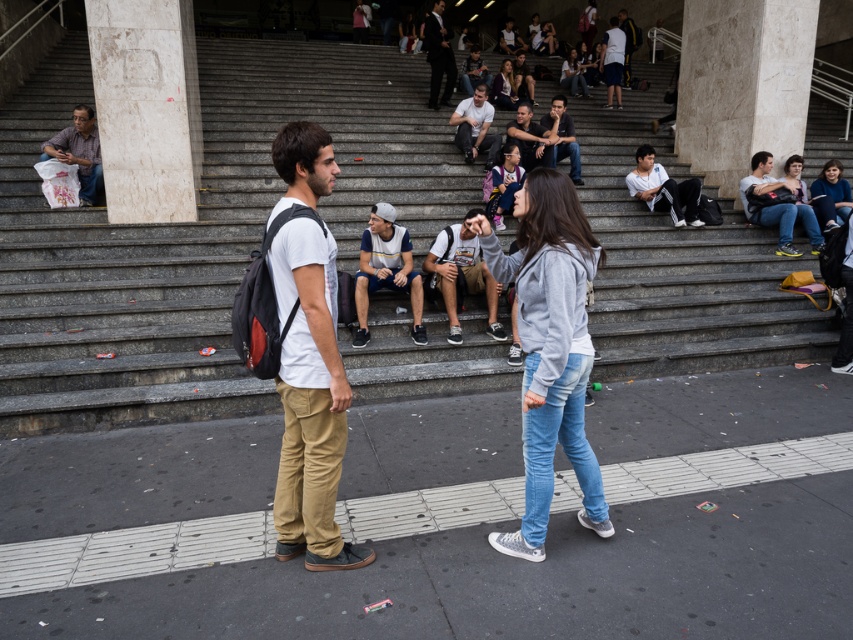
You are a photographer trying to capture a candid shot of the two people in the scene. You notice the light blue denim jeans at center and the dark gray backpack at center. Which object is wider in the frame to ensure proper framing?

The light blue denim jeans at center is wider than the dark gray backpack at center, so you should frame the shot to accommodate its larger width.

You are a photographer trying to capture a candid shot of the white cotton shirt at upper center without including the dark gray backpack at right in the frame. Based on their positions, is this possible?

The dark gray backpack at right is positioned on the right side of the white cotton shirt at upper center, so if you position yourself to the left of the shirt, you can frame the shot to exclude the backpack.